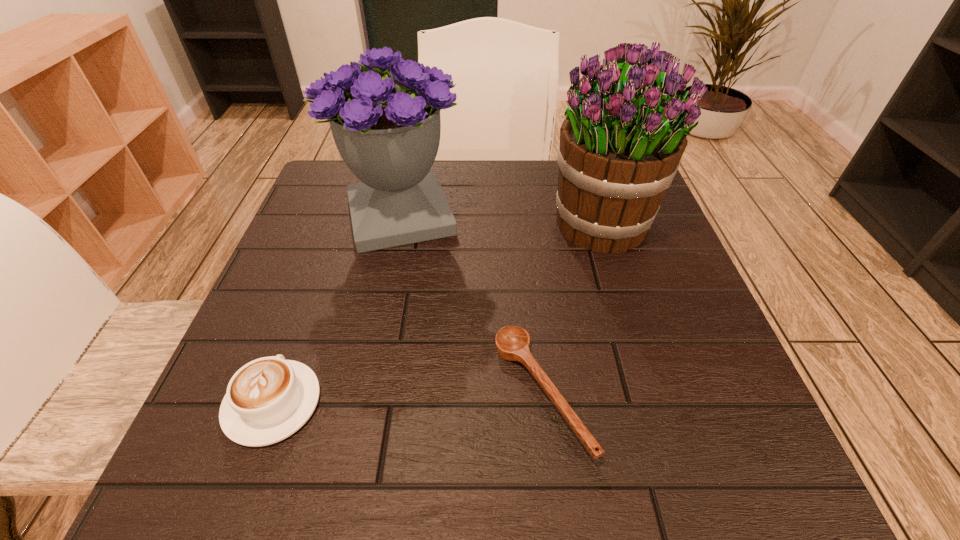
You are a GUI agent. You are given a task and a screenshot of the screen. Output one action in this format:
    pyautogui.click(x=<x>, y=<y>)
    Task: Click on the vacant space at the left edge of the desktop
    The width and height of the screenshot is (960, 540).
    Given the screenshot: What is the action you would take?
    pos(323,230)

Locate an element on the screen. The width and height of the screenshot is (960, 540). vacant area at the right edge of the desktop is located at coordinates (651, 233).

In the image, there is a desktop. Identify the location of free space at the far left corner. (332, 205).

Where is `blank region between the left bouquet and the right bouquet`? blank region between the left bouquet and the right bouquet is located at coordinates (x=502, y=220).

Where is `vacant area that lies between the shortest object and the right bouquet`? vacant area that lies between the shortest object and the right bouquet is located at coordinates (573, 309).

Locate an element on the screen. This screenshot has height=540, width=960. free spot between the second shortest object and the shortest object is located at coordinates (407, 398).

Locate an element on the screen. The image size is (960, 540). vacant space that's between the wooden spoon and the left bouquet is located at coordinates (470, 305).

Identify the location of vacant point located between the cappuccino and the right bouquet. (439, 314).

This screenshot has height=540, width=960. Find the location of `vacant space that is in between the left bouquet and the shortest object`. vacant space that is in between the left bouquet and the shortest object is located at coordinates (470, 305).

The image size is (960, 540). What are the coordinates of `free space between the right bouquet and the shortest object` in the screenshot? It's located at (573, 309).